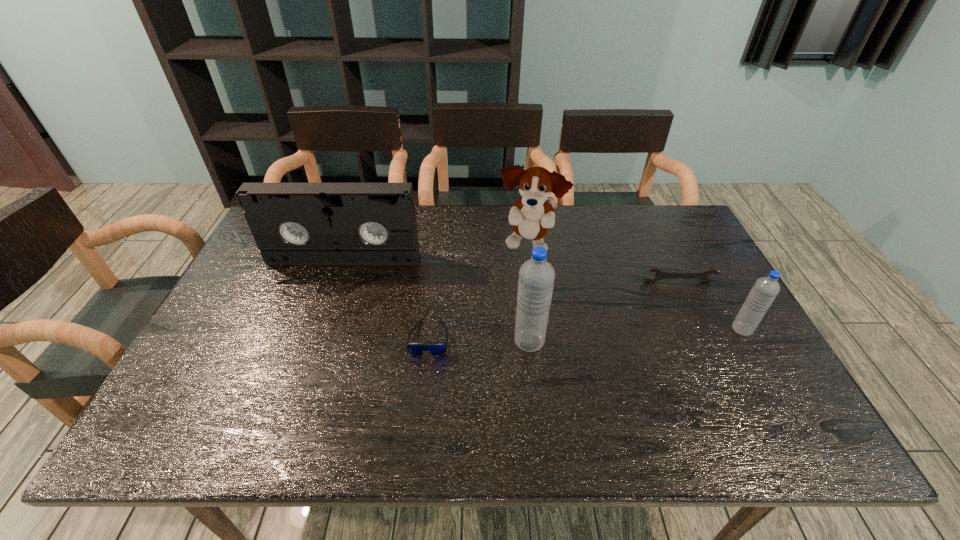
Please point out where to position a new water bottle on the left to maintain spacing. Please provide its 2D coordinates. Your answer should be formatted as a tuple, i.e. [(x, y)], where the tuple contains the x and y coordinates of a point satisfying the conditions above.

[(305, 354)]